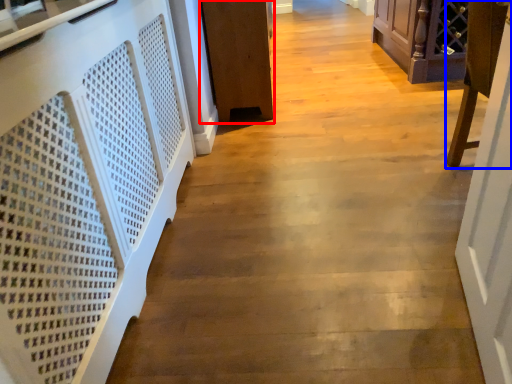
Question: Which object is further to the camera taking this photo, furniture (highlighted by a red box) or furniture (highlighted by a blue box)?

Choices:
 (A) furniture
 (B) furniture

Answer: (A)